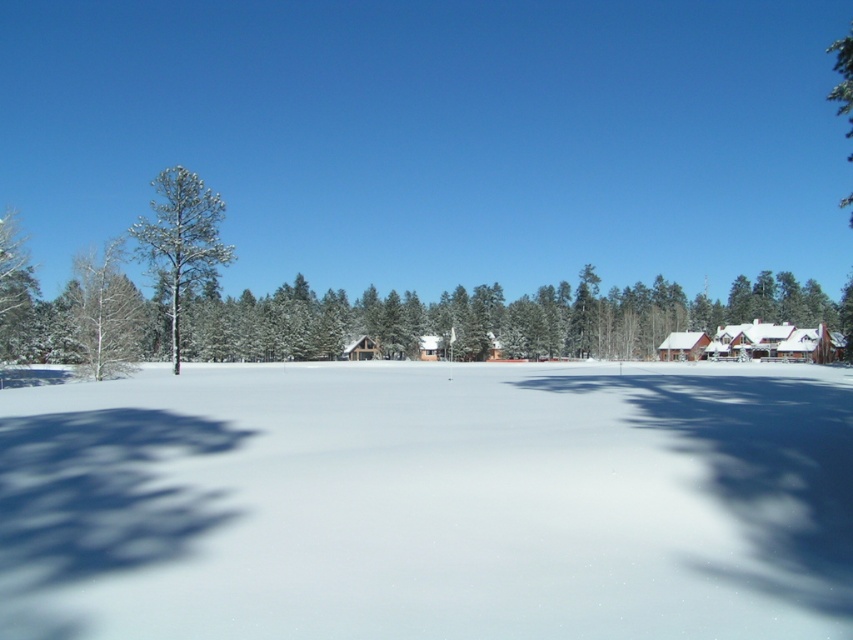
Is the position of snow-covered pine tree at left more distant than that of wooden cabin at right?

No.

At what (x,y) coordinates should I click in order to perform the action: click on snow-covered pine tree at left. Please return your answer as a coordinate pair (x, y). The height and width of the screenshot is (640, 853). Looking at the image, I should click on (181, 240).

The height and width of the screenshot is (640, 853). What do you see at coordinates (181, 240) in the screenshot? I see `snow-covered pine tree at left` at bounding box center [181, 240].

Image resolution: width=853 pixels, height=640 pixels. In order to click on snow-covered pine tree at left in this screenshot , I will do `click(181, 240)`.

Who is shorter, snow-covered pine tree at left or white smooth tree at left?

white smooth tree at left is shorter.

Is snow-covered pine tree at left above white smooth tree at left?

Indeed, snow-covered pine tree at left is positioned over white smooth tree at left.

Does point (199, 260) come behind point (79, 257)?

Yes, point (199, 260) is behind point (79, 257).

Find the location of a particular element. snow-covered pine tree at left is located at coordinates point(181,240).

In the scene shown: Does white smooth tree at left come in front of white wooden cabin at center?

Yes, white smooth tree at left is in front of white wooden cabin at center.

Who is more distant from viewer, (120,320) or (355,356)?

Point (355,356)

Find the location of `white smooth tree at left`. white smooth tree at left is located at coordinates (103, 314).

Identify the location of white smooth tree at left. This screenshot has height=640, width=853. (103, 314).